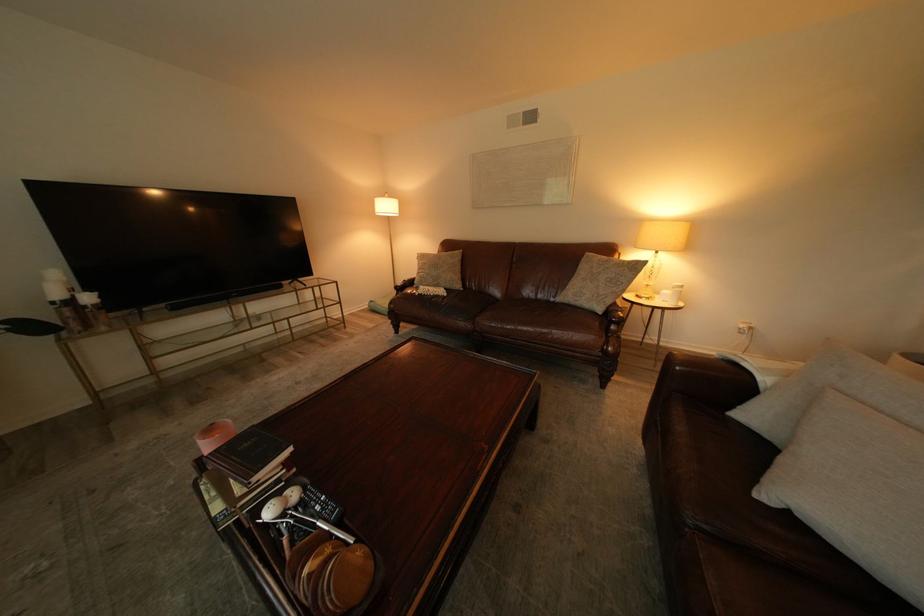
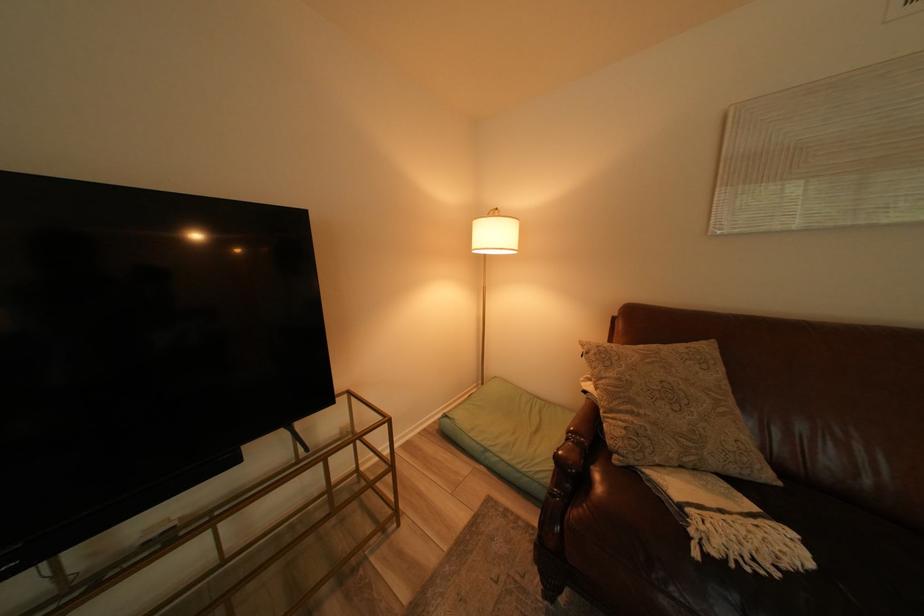
Which direction would the cameraman need to move to produce the second image?

The cameraman moved toward left, forward.